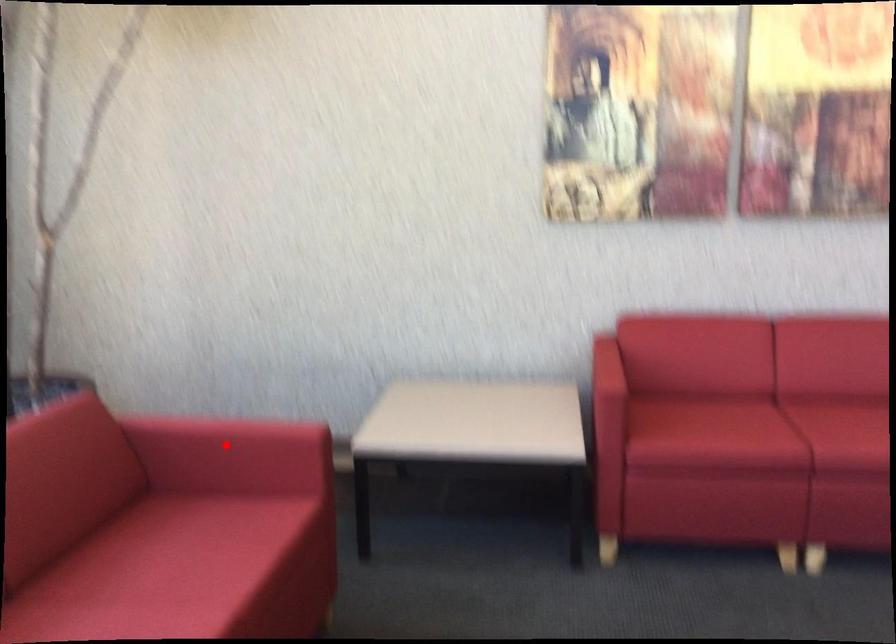
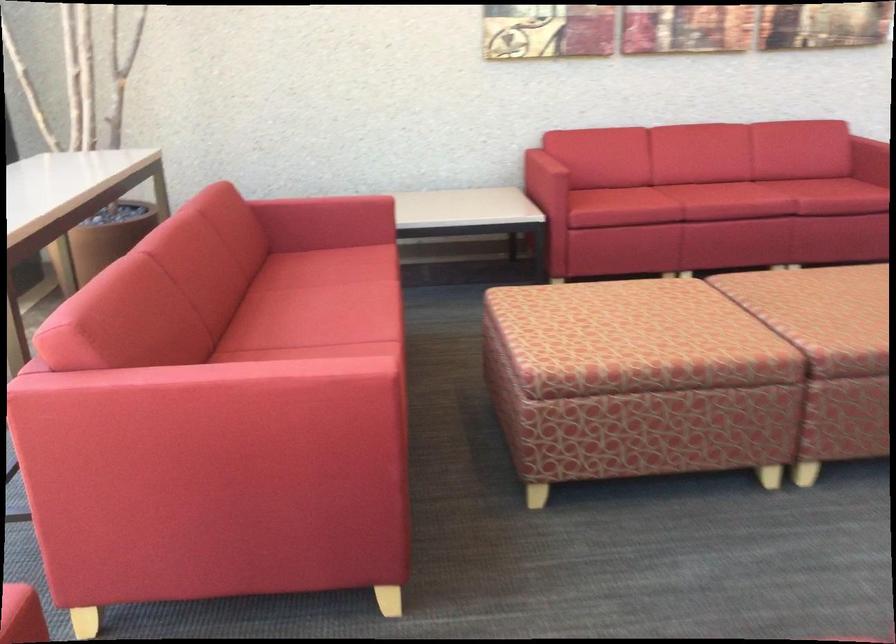
Question: I am providing you with two images of the same scene from different viewpoints. A red point is shown in image1. For the corresponding object point in image2, is it positioned nearer or farther from the camera?

Choices:
 (A) Nearer
 (B) Farther

Answer: (B)